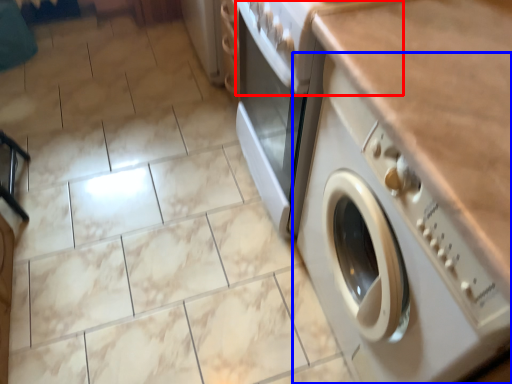
Question: Which object appears closest to the camera in this image, gas stove (highlighted by a red box) or washing machine (highlighted by a blue box)?

Choices:
 (A) gas stove
 (B) washing machine

Answer: (B)